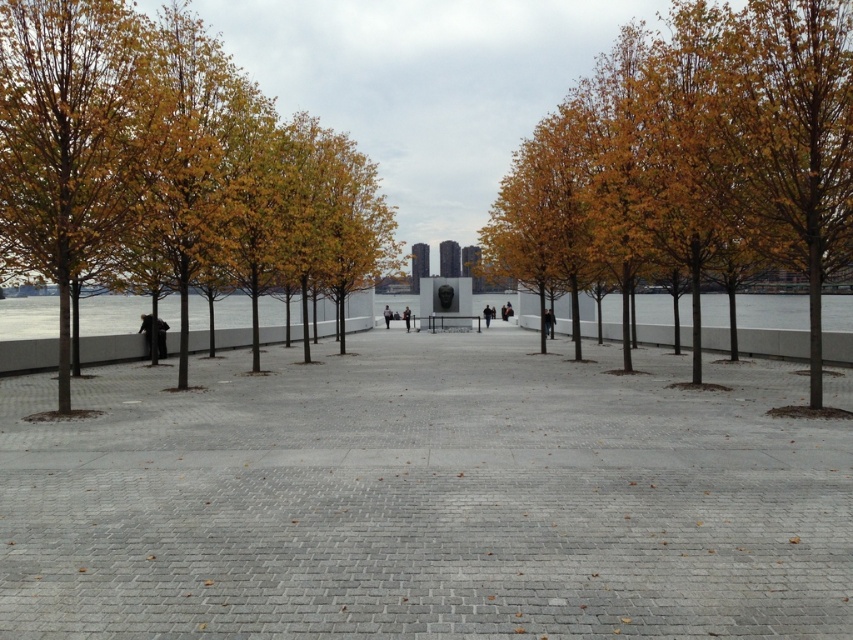
This screenshot has height=640, width=853. What do you see at coordinates (425, 499) in the screenshot?
I see `gray brick pavement at center` at bounding box center [425, 499].

Can you confirm if gray brick pavement at center is shorter than golden leafy tree at left?

Yes.

What do you see at coordinates (425, 499) in the screenshot? I see `gray brick pavement at center` at bounding box center [425, 499].

Identify the location of gray brick pavement at center. The image size is (853, 640). (425, 499).

Who is more forward, (x=489, y=316) or (x=390, y=308)?

Point (x=489, y=316) is in front.

Between point (486, 308) and point (387, 326), which one is positioned in front?

Positioned in front is point (486, 308).

The height and width of the screenshot is (640, 853). I want to click on black fabric person at center, so click(486, 314).

Is yellow leaves at center wider than black fabric person at center?

Indeed, yellow leaves at center has a greater width compared to black fabric person at center.

Is yellow leaves at center above black fabric person at center?

Correct, yellow leaves at center is located above black fabric person at center.

Which is behind, point (715, 33) or point (490, 314)?

The point (490, 314) is behind.

You are a GUI agent. You are given a task and a screenshot of the screen. Output one action in this format:
    pyautogui.click(x=<x>, y=<y>)
    Task: Click on the yellow leaves at center
    This screenshot has height=640, width=853.
    Given the screenshot: What is the action you would take?
    pyautogui.click(x=735, y=145)